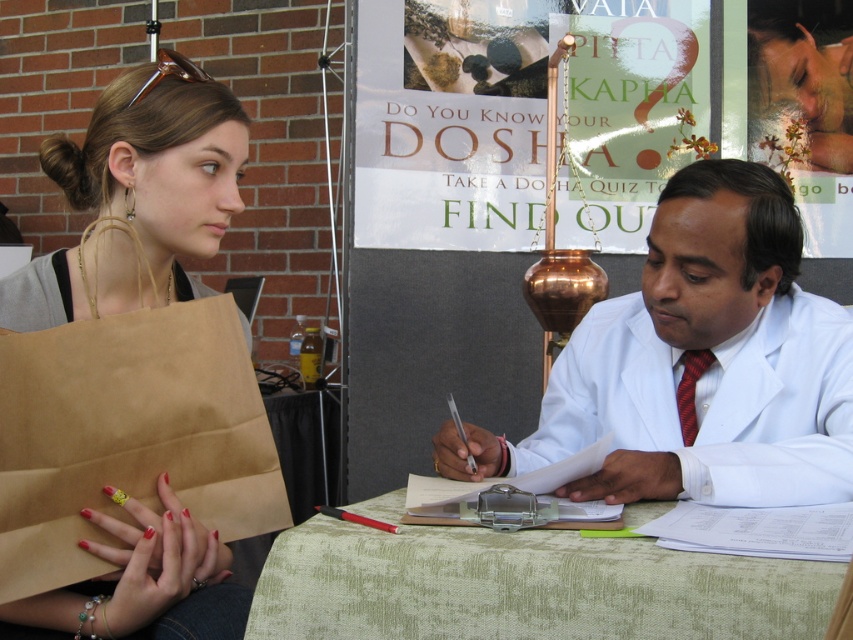
Does white lab coat at center have a greater width compared to brown paper bag at left?

Yes, white lab coat at center is wider than brown paper bag at left.

Can you confirm if white lab coat at center is positioned below brown paper bag at left?

Yes.

Who is more distant from viewer, (x=578, y=404) or (x=131, y=145)?

Point (x=578, y=404)

At what (x,y) coordinates should I click in order to perform the action: click on white lab coat at center. Please return your answer as a coordinate pair (x, y). The image size is (853, 640). Looking at the image, I should click on (708, 368).

Between point (677, 380) and point (305, 593), which one is positioned behind?

Positioned behind is point (677, 380).

Can you confirm if white lab coat at center is shorter than green fabric table at center?

In fact, white lab coat at center may be taller than green fabric table at center.

Which is in front, point (589, 355) or point (500, 618)?

Point (500, 618)

I want to click on white lab coat at center, so click(708, 368).

Can you confirm if brown paper bag at left is positioned below red silk tie at right?

Incorrect, brown paper bag at left is not positioned below red silk tie at right.

Is the position of brown paper bag at left less distant than that of red silk tie at right?

Yes, it is in front of red silk tie at right.

This screenshot has height=640, width=853. Identify the location of brown paper bag at left. [x=137, y=196].

Find the location of a particular element. The width and height of the screenshot is (853, 640). brown paper bag at left is located at coordinates (137, 196).